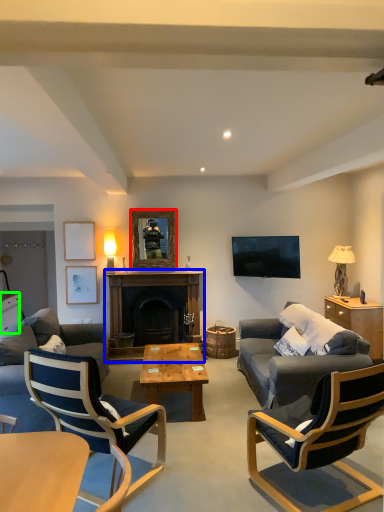
Question: Estimate the real-world distances between objects in this image. Which object is closer to mirror (highlighted by a red box), fireplace (highlighted by a blue box) or cabinetry (highlighted by a green box)?

Choices:
 (A) fireplace
 (B) cabinetry

Answer: (A)